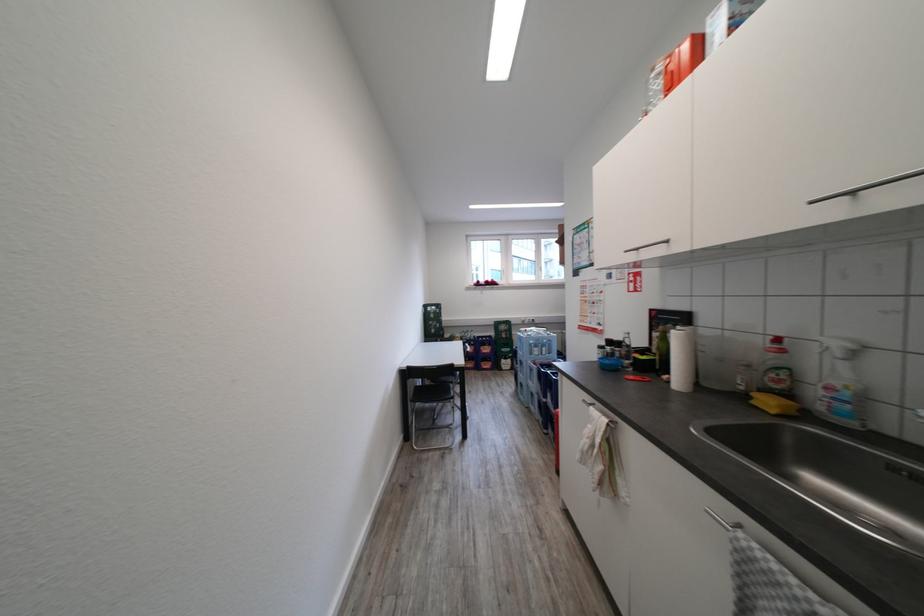
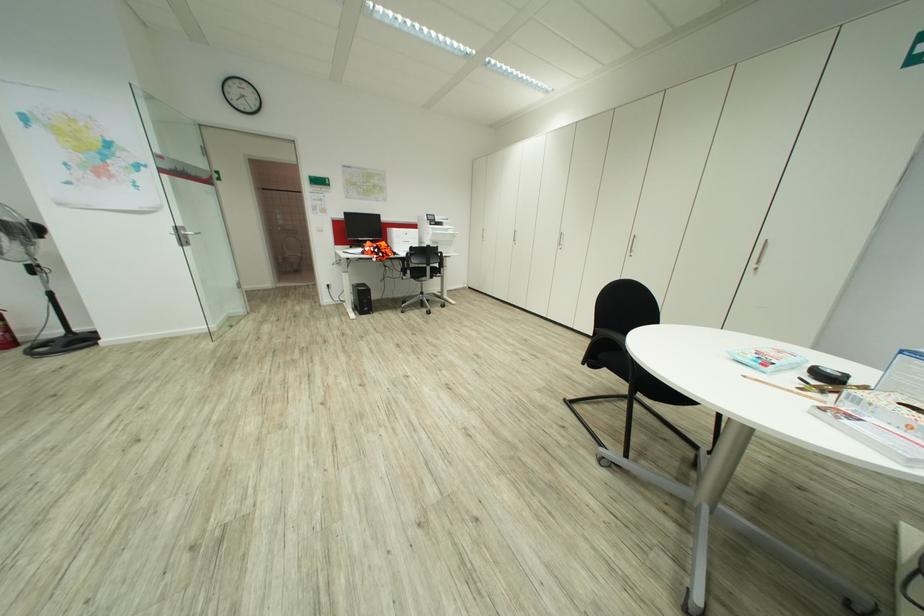
Question: I am providing you with two images of the same scene from different viewpoints. After the viewpoint changes to image2, which objects are now occluded?

Choices:
 (A) metal door handle
 (B) grey stuffed toy
 (C) chair sitting surface
 (D) silver cabinet handle

Answer: (C)